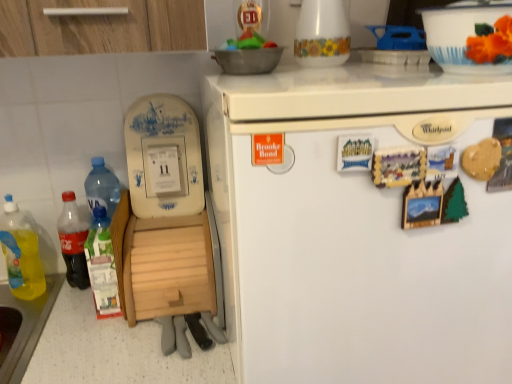
Question: Is translucent plastic soda bottle at left, the second bottle viewed from the left, in contact with wooden at left?

Choices:
 (A) no
 (B) yes

Answer: (A)

Question: Would you consider translucent plastic soda bottle at left, the second bottle viewed from the left, to be distant from wooden at left?

Choices:
 (A) yes
 (B) no

Answer: (B)

Question: From a real-world perspective, is translucent plastic soda bottle at left, marked as the second bottle in a right-to-left arrangement, located beneath wooden at left?

Choices:
 (A) no
 (B) yes

Answer: (A)

Question: Considering the relative sizes of translucent plastic soda bottle at left, the second bottle viewed from the left, and wooden at left in the image provided, is translucent plastic soda bottle at left, the second bottle viewed from the left, smaller than wooden at left?

Choices:
 (A) no
 (B) yes

Answer: (B)

Question: Is translucent plastic soda bottle at left, the second bottle viewed from the left, positioned in front of wooden at left?

Choices:
 (A) no
 (B) yes

Answer: (A)

Question: Looking at their shapes, would you say yellow translucent liquid at lower left, positioned as the first bottle in left-to-right order, is wider or thinner than translucent plastic soda bottle at left, the second bottle viewed from the left?

Choices:
 (A) thin
 (B) wide

Answer: (A)

Question: Is yellow translucent liquid at lower left, positioned as the first bottle in left-to-right order, in front of or behind translucent plastic soda bottle at left, the second bottle viewed from the left, in the image?

Choices:
 (A) behind
 (B) front

Answer: (B)

Question: Is point (30, 253) closer or farther from the camera than point (72, 190)?

Choices:
 (A) farther
 (B) closer

Answer: (B)

Question: From their relative heights in the image, would you say yellow translucent liquid at lower left, which appears as the 3th bottle when viewed from the right, is taller or shorter than translucent plastic soda bottle at left, marked as the second bottle in a right-to-left arrangement?

Choices:
 (A) short
 (B) tall

Answer: (B)

Question: Does point (96, 263) appear closer or farther from the camera than point (11, 215)?

Choices:
 (A) closer
 (B) farther

Answer: (A)

Question: Based on their sizes in the image, would you say translucent plastic bottle at lower left, placed as the 3th bottle when sorted from left to right, is bigger or smaller than yellow translucent liquid at lower left, which appears as the 3th bottle when viewed from the right?

Choices:
 (A) big
 (B) small

Answer: (B)

Question: Considering their positions, is translucent plastic bottle at lower left, arranged as the first bottle when viewed from the right, located in front of or behind yellow translucent liquid at lower left, positioned as the first bottle in left-to-right order?

Choices:
 (A) front
 (B) behind

Answer: (B)

Question: Do you think translucent plastic bottle at lower left, placed as the 3th bottle when sorted from left to right, is within yellow translucent liquid at lower left, positioned as the first bottle in left-to-right order, or outside of it?

Choices:
 (A) inside
 (B) outside

Answer: (B)

Question: Based on their sizes in the image, would you say white glossy bowl at upper right is bigger or smaller than translucent plastic soda bottle at left, the second bottle viewed from the left?

Choices:
 (A) big
 (B) small

Answer: (A)

Question: From a real-world perspective, relative to translucent plastic soda bottle at left, marked as the second bottle in a right-to-left arrangement, is white glossy bowl at upper right vertically above or below?

Choices:
 (A) below
 (B) above

Answer: (B)